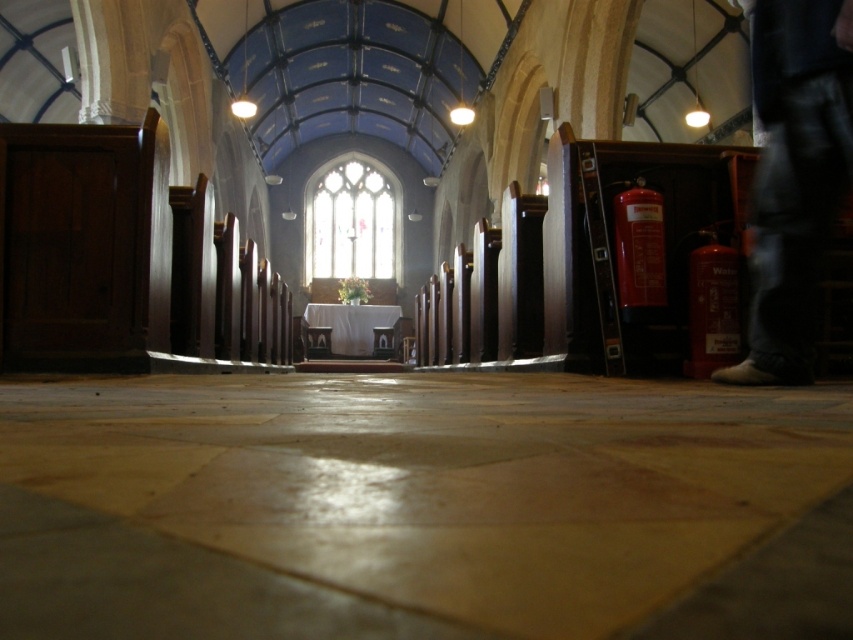
Can you confirm if smooth stone aisle at center is thinner than jeans at right?

No, smooth stone aisle at center is not thinner than jeans at right.

Can you confirm if smooth stone aisle at center is smaller than jeans at right?

Indeed, smooth stone aisle at center has a smaller size compared to jeans at right.

You are a GUI agent. You are given a task and a screenshot of the screen. Output one action in this format:
    pyautogui.click(x=<x>, y=<y>)
    Task: Click on the smooth stone aisle at center
    This screenshot has height=640, width=853.
    Given the screenshot: What is the action you would take?
    pyautogui.click(x=390, y=500)